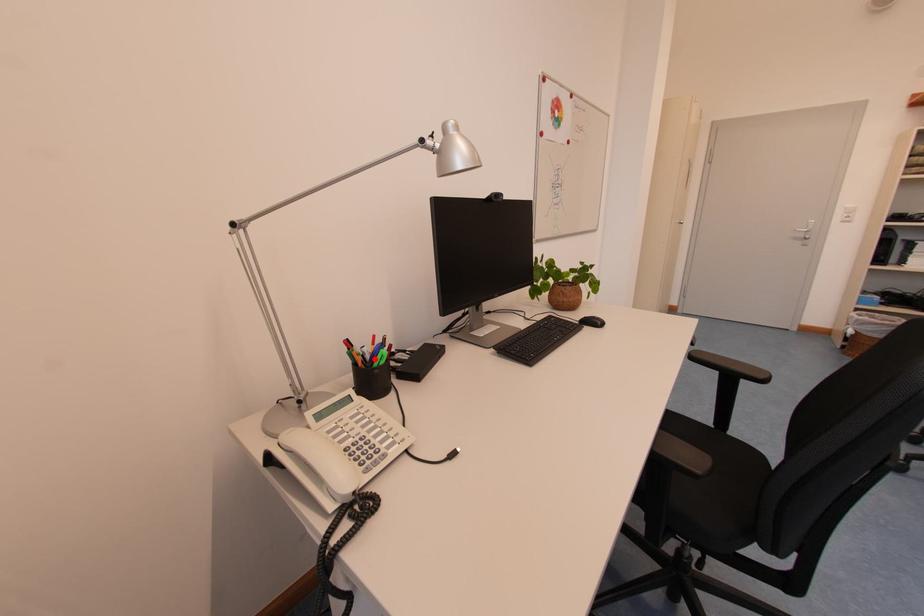
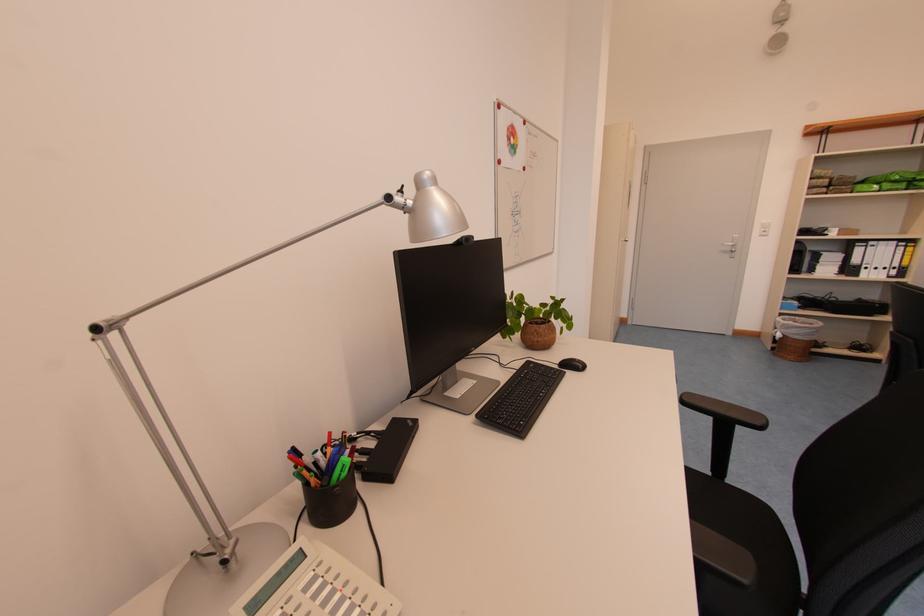
Question: I am providing you with two images of the same scene from different viewpoints. In image1, a red point is highlighted. Considering the same 3D point in image2, which of the following is correct?

Choices:
 (A) It is closer
 (B) It is farther

Answer: (A)